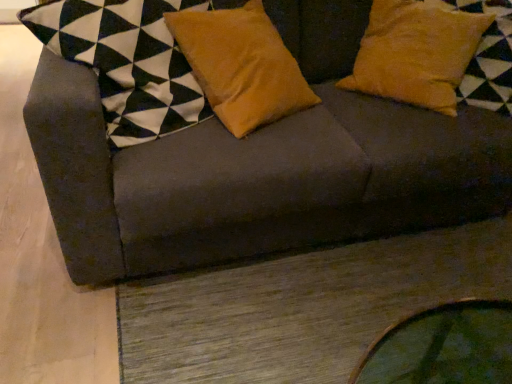
Question: From the image's perspective, does velvet orange pillow at center, which appears as the first pillow when viewed from the left, appear higher than dark gray fabric couch at upper center?

Choices:
 (A) yes
 (B) no

Answer: (A)

Question: Is velvet orange pillow at center, which is the 2th pillow in right-to-left order, outside of dark gray fabric couch at upper center?

Choices:
 (A) yes
 (B) no

Answer: (B)

Question: Is the depth of velvet orange pillow at center, which is the 2th pillow in right-to-left order, greater than that of dark gray fabric couch at upper center?

Choices:
 (A) no
 (B) yes

Answer: (B)

Question: Does velvet orange pillow at center, which appears as the first pillow when viewed from the left, have a lesser height compared to dark gray fabric couch at upper center?

Choices:
 (A) no
 (B) yes

Answer: (B)

Question: From the image's perspective, is velvet orange pillow at center, which is the 2th pillow in right-to-left order, below dark gray fabric couch at upper center?

Choices:
 (A) yes
 (B) no

Answer: (B)

Question: Does velvet orange pillow at center, which is the 2th pillow in right-to-left order, appear on the left side of dark gray fabric couch at upper center?

Choices:
 (A) yes
 (B) no

Answer: (A)

Question: Is suede yellow pillow at upper right, the first pillow viewed from the right, turned away from velvet orange pillow at center, which is the 2th pillow in right-to-left order?

Choices:
 (A) no
 (B) yes

Answer: (A)

Question: From the image's perspective, is suede yellow pillow at upper right, the first pillow viewed from the right, beneath velvet orange pillow at center, which appears as the first pillow when viewed from the left?

Choices:
 (A) no
 (B) yes

Answer: (A)

Question: Is suede yellow pillow at upper right, the first pillow viewed from the right, thinner than velvet orange pillow at center, which is the 2th pillow in right-to-left order?

Choices:
 (A) yes
 (B) no

Answer: (B)

Question: Does suede yellow pillow at upper right, the first pillow viewed from the right, have a smaller size compared to velvet orange pillow at center, which is the 2th pillow in right-to-left order?

Choices:
 (A) yes
 (B) no

Answer: (B)

Question: From the image's perspective, is suede yellow pillow at upper right, the first pillow viewed from the right, on velvet orange pillow at center, which appears as the first pillow when viewed from the left?

Choices:
 (A) yes
 (B) no

Answer: (A)

Question: Is suede yellow pillow at upper right, the first pillow viewed from the right, at the right side of velvet orange pillow at center, which appears as the first pillow when viewed from the left?

Choices:
 (A) yes
 (B) no

Answer: (A)

Question: Does suede yellow pillow at upper right, the first pillow viewed from the right, touch dark gray fabric couch at upper center?

Choices:
 (A) no
 (B) yes

Answer: (A)